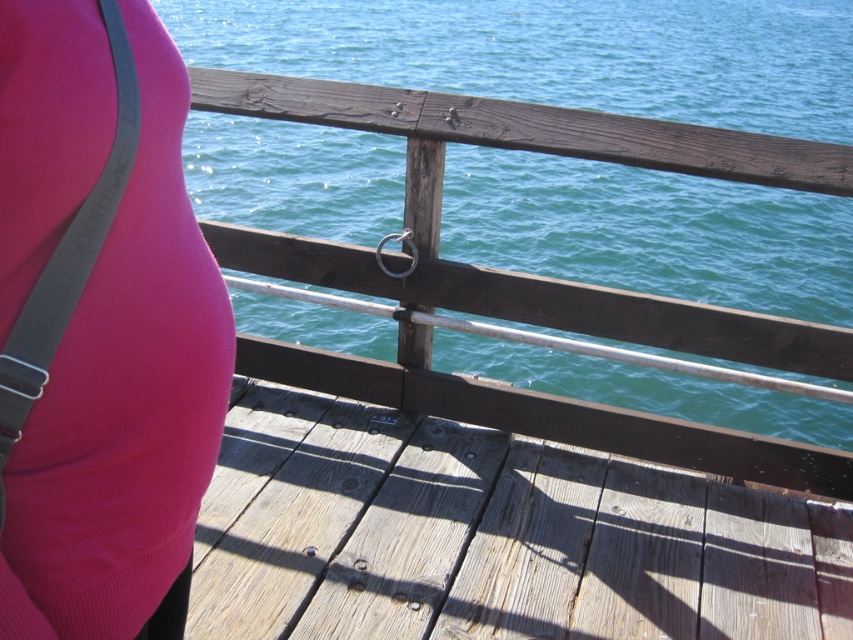
You are standing on the wooden pier and want to walk from point (x=300, y=157) to point (x=576, y=540). Which direction should you face to move towards the farther point?

You should face away from the viewer because point (x=300, y=157) is closer to you than point (x=576, y=540), so moving towards the farther point requires facing away from the viewer.

You are trying to determine if the weathered wood deck at center can accommodate a small rectangular object placed on the matte pink fabric at center. Based on their widths, will the deck have enough space to hold the object?

The weathered wood deck at center is wider than the matte pink fabric at center, so it has enough space to hold the object placed on the matte pink fabric at center.

You are standing on the wooden pier and see the teal water at center and the matte pink fabric at center. Which object is closer to you?

The teal water at center is closer to you because it is further to the viewer than the matte pink fabric at center.